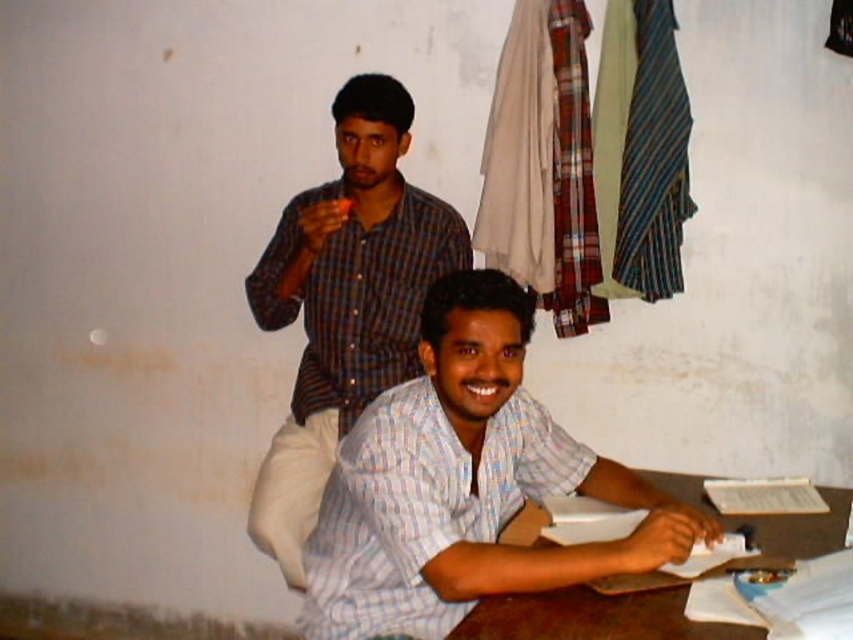
You are standing at point (x=312, y=401) and want to move to point (x=674, y=504). Is the point you want to reach in front of or behind you?

The point (x=674, y=504) is in front of point (x=312, y=401), so the destination is in front of you.

You are standing in the room and see the point at coordinates (465, 484). Which object from the list contains this point? The objects are the light blue checkered shirt at center and the wooden table.

→ The point at coordinates (465, 484) is on the light blue checkered shirt at center.